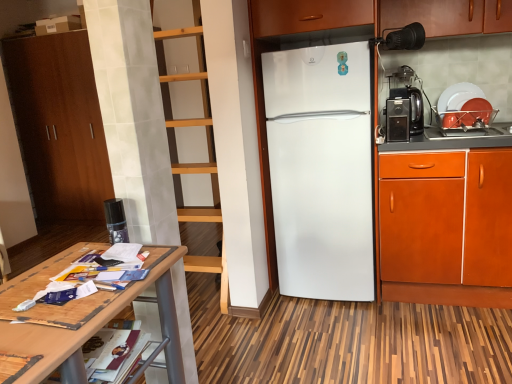
Locate an element on the screen. This screenshot has height=384, width=512. free space above wooden table at lower left (from a real-world perspective) is located at coordinates (66, 300).